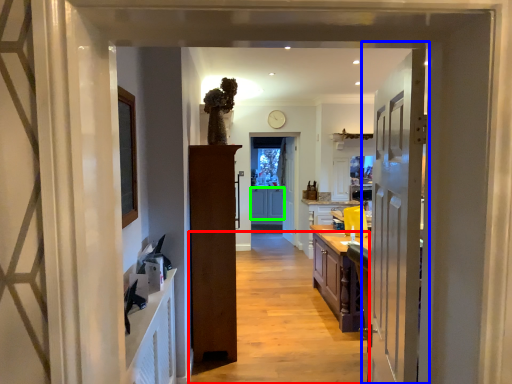
Question: Which is nearer to the path (highlighted by a red box)? door (highlighted by a blue box) or cabinetry (highlighted by a green box).

Choices:
 (A) door
 (B) cabinetry

Answer: (A)